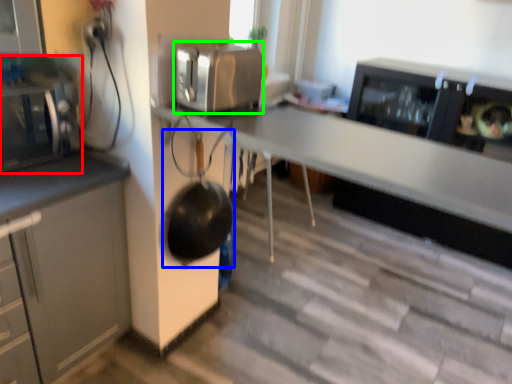
Question: Considering the real-world distances, which object is closest to home appliance (highlighted by a red box)? wok (highlighted by a blue box) or kitchen appliance (highlighted by a green box).

Choices:
 (A) wok
 (B) kitchen appliance

Answer: (A)